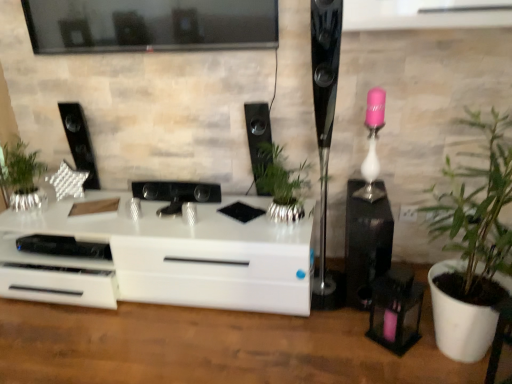
I want to click on vacant space in front of white glossy chest of drawers at center, so click(139, 350).